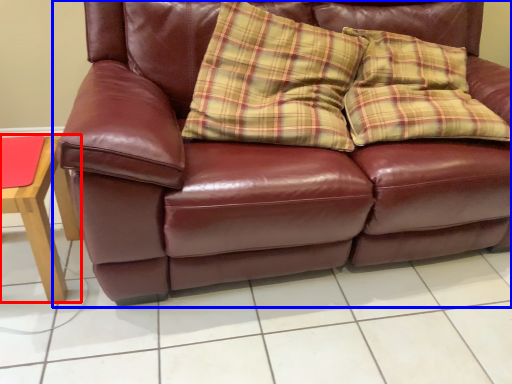
Question: Which point is further to the camera, table (highlighted by a red box) or studio couch (highlighted by a blue box)?

Choices:
 (A) table
 (B) studio couch

Answer: (A)